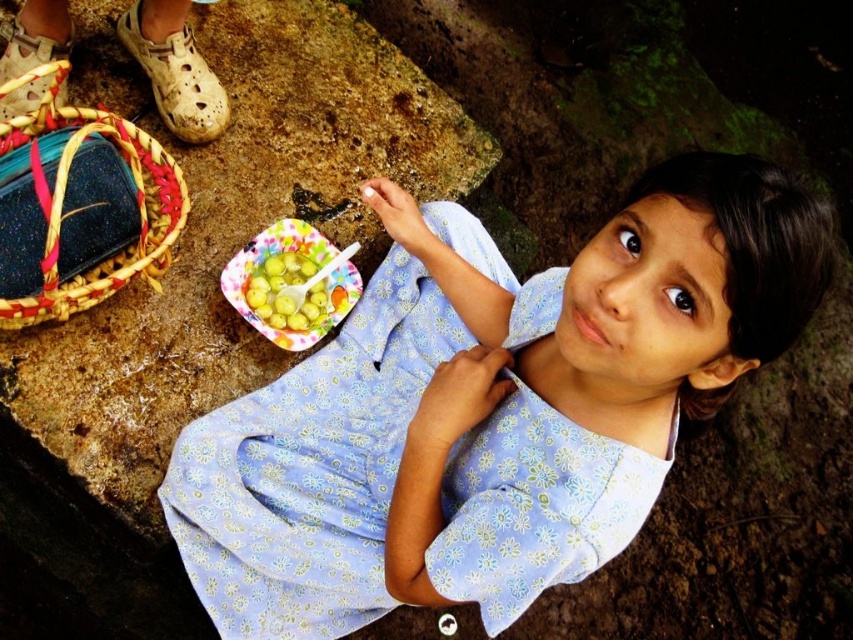
The girl is trying to place a napkin on the table. She has a colorful paper plate at center and a green matte fruit at center. Which object should she place the napkin under to keep it from sliding off the edge?

The girl should place the napkin under the green matte fruit at center because the colorful paper plate at center is above it, so the fruit is lower and closer to the table edge.

You are a photographer taking a picture of the scene. You need to ensure that the woven straw basket at lower left and the green matte fruit at center are both in focus. Which object should you adjust your camera focus on first to ensure both are sharp?

The woven straw basket at lower left is above the green matte fruit at center. To ensure both are in focus, you should focus on the woven straw basket at lower left first, as it is closer to the camera, and the depth of field will naturally include the farther object.